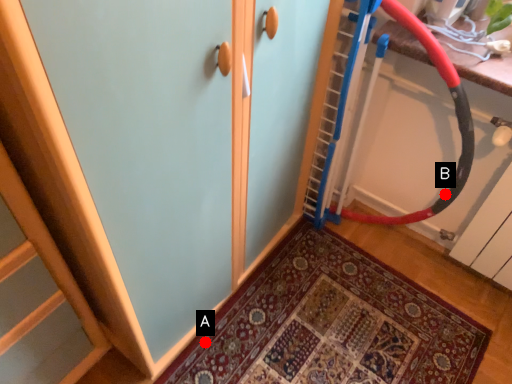
Question: Two points are circled on the image, labeled by A and B beside each circle. Which point is closer to the camera taking this photo?

Choices:
 (A) A is closer
 (B) B is closer

Answer: (A)